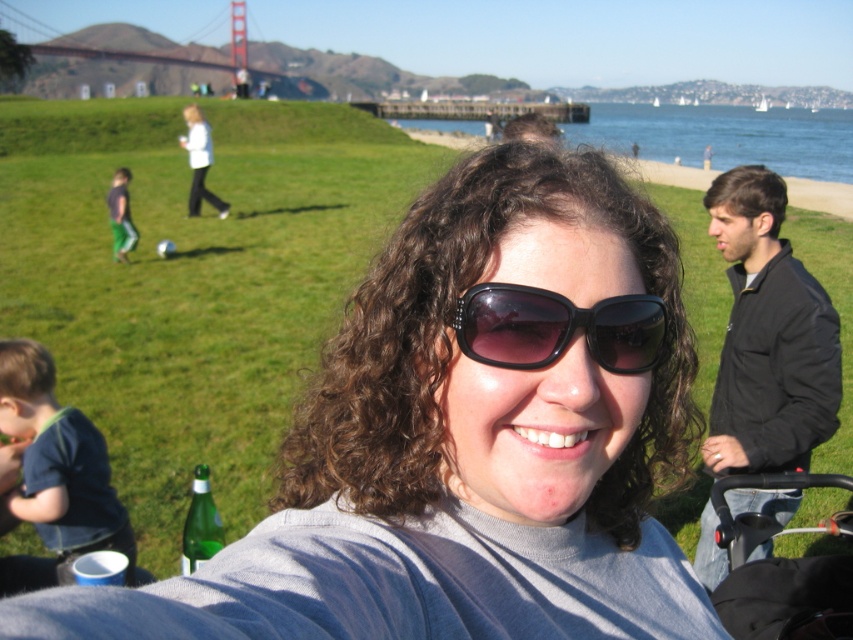
Measure the distance between point (x=756, y=400) and camera.

Point (x=756, y=400) and camera are 11.33 feet apart.

Is black matte jacket at right positioned in front of light blue jacket at upper left?

That is True.

Measure the distance between point (x=825, y=428) and camera.

Point (x=825, y=428) is 3.30 meters from camera.

The image size is (853, 640). In order to click on black matte jacket at right in this screenshot , I will do `click(769, 337)`.

Between blue water at upper right and black matte sunglasses at center, which one appears on the right side from the viewer's perspective?

blue water at upper right is more to the right.

Is point (676, 154) closer to camera compared to point (646, 305)?

That is False.

Which is behind, point (647, 116) or point (508, 289)?

Point (647, 116)

Locate an element on the screen. This screenshot has height=640, width=853. blue water at upper right is located at coordinates (724, 136).

Does black plastic baby carriage at lower right have a greater height compared to black matte sunglasses at center?

Yes.

Locate an element on the screen. This screenshot has width=853, height=640. black plastic baby carriage at lower right is located at coordinates (778, 572).

Does point (723, 592) come behind point (544, 307)?

Yes.

The image size is (853, 640). Identify the location of black plastic baby carriage at lower right. (778, 572).